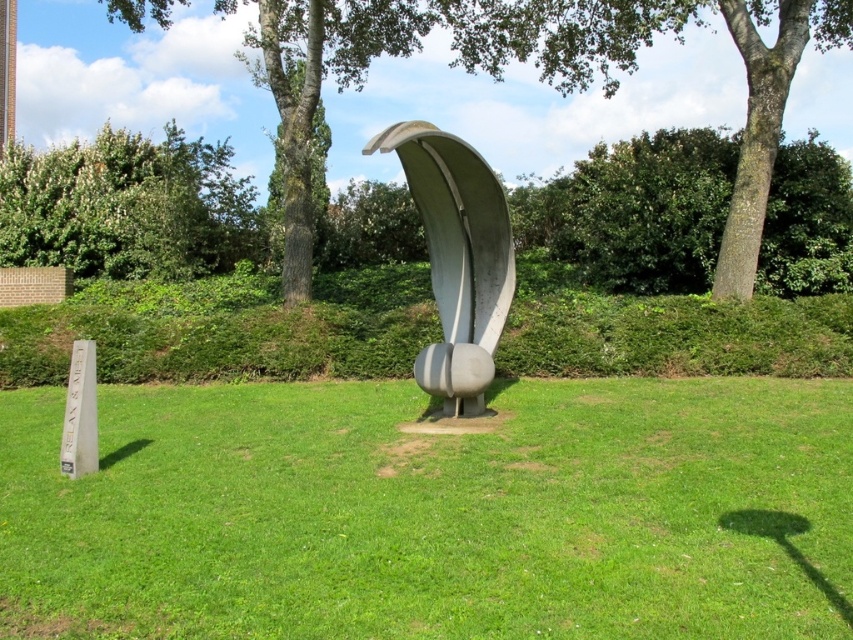
Question: Which point is closer to the camera taking this photo?

Choices:
 (A) (117, 209)
 (B) (4, 609)
 (C) (503, 317)

Answer: (B)

Question: Among these points, which one is farthest from the camera?

Choices:
 (A) (248, 189)
 (B) (483, 192)
 (C) (811, 381)

Answer: (A)

Question: Estimate the real-world distances between objects in this image. Which object is farther from the green leafy tree at upper left?

Choices:
 (A) satin gray sculpture at center
 (B) green grass at center

Answer: (B)

Question: Can you confirm if green grass at center is positioned to the left of satin gray sculpture at center?

Choices:
 (A) no
 (B) yes

Answer: (A)

Question: From the image, what is the correct spatial relationship of green grass at center in relation to green leafy tree at upper left?

Choices:
 (A) left
 (B) right

Answer: (B)

Question: Can you confirm if green grass at center is wider than satin gray sculpture at center?

Choices:
 (A) yes
 (B) no

Answer: (A)